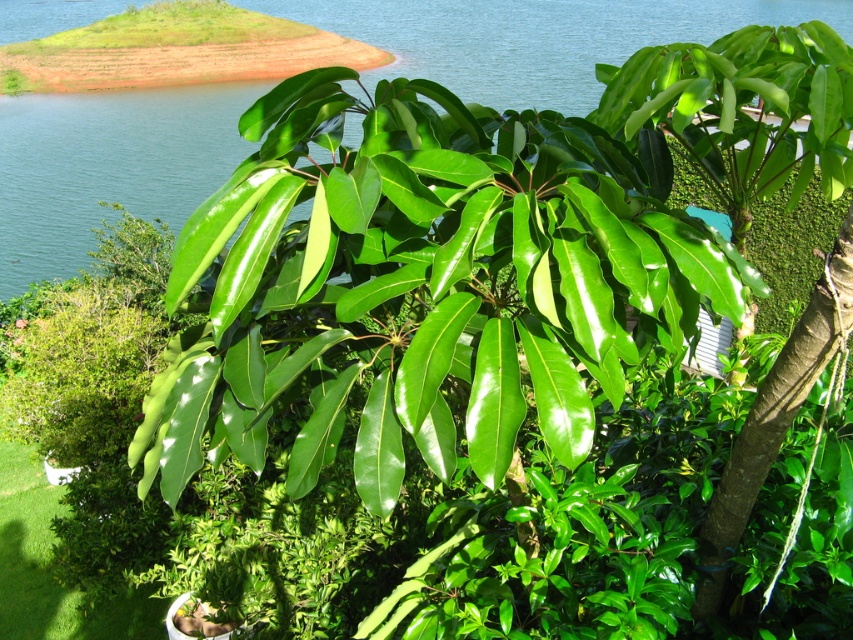
You are an artist trying to paint the landscape. You want to place the green water at upper center accurately. According to the coordinates provided, where should you position it on your canvas?

The green water at upper center should be positioned at the coordinates point (x=107, y=166) on the canvas.

You are an environmental scientist analyzing the scene. You need to determine which object occupies more horizontal space in the image. Which one is wider between the green water at upper center and the green glossy leaves at center?

The green water at upper center is wider than the green glossy leaves at center because its width surpasses that of the leaves.